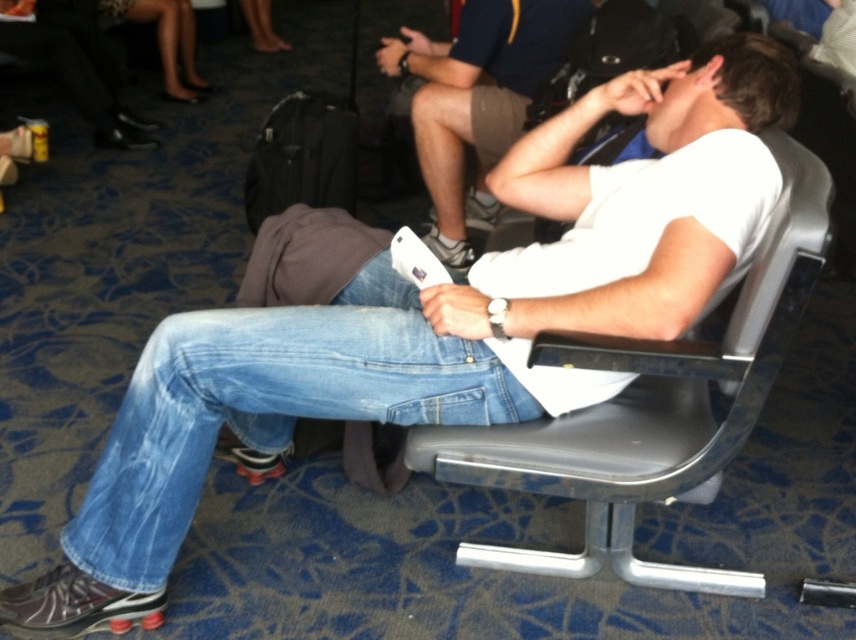
Question: Which object is farther from the camera taking this photo?

Choices:
 (A) black fabric suitcase at center
 (B) white matte shirt at center
 (C) metallic gray chair at center

Answer: (A)

Question: Is denim at center below black fabric suitcase at center?

Choices:
 (A) yes
 (B) no

Answer: (A)

Question: Which object appears farthest from the camera in this image?

Choices:
 (A) metallic gray chair at center
 (B) white matte shirt at center

Answer: (B)

Question: Which object is positioned farthest from the black fabric suitcase at center?

Choices:
 (A) denim at center
 (B) white matte shirt at center
 (C) metallic gray chair at center

Answer: (C)

Question: In this image, where is metallic gray chair at center located relative to white matte shirt at center?

Choices:
 (A) above
 (B) below

Answer: (B)

Question: Does denim at center have a lesser width compared to white matte shirt at center?

Choices:
 (A) yes
 (B) no

Answer: (B)